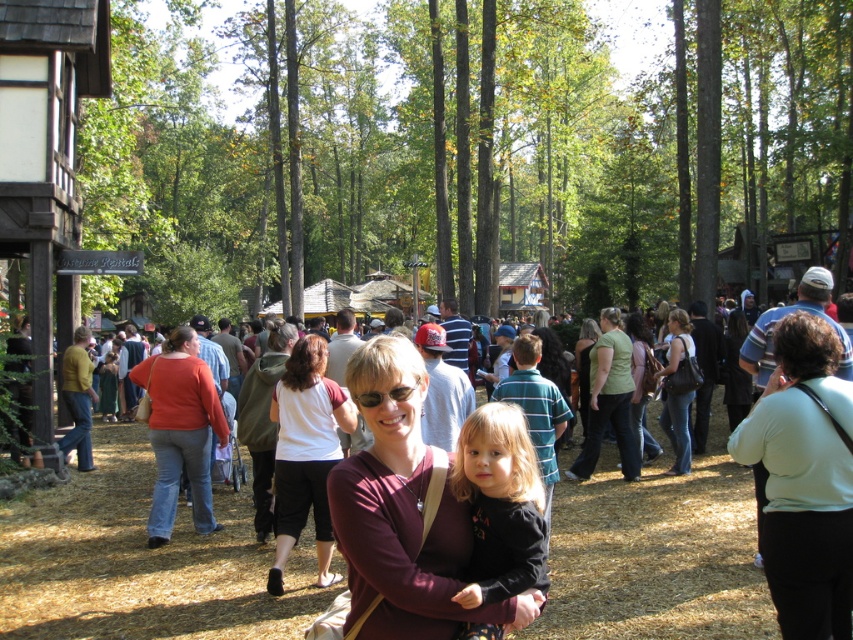
Is point (788, 458) farther from camera compared to point (184, 420)?

No, (788, 458) is in front of (184, 420).

Describe the element at coordinates (804, 480) in the screenshot. The image size is (853, 640). I see `light green fabric at center` at that location.

Does point (790, 483) lie behind point (161, 484)?

No, (790, 483) is in front of (161, 484).

Locate an element on the screen. light green fabric at center is located at coordinates (804, 480).

Which is more to the right, black matte shirt at center or matte black purse at center?

matte black purse at center

Does black matte shirt at center appear on the right side of matte black purse at center?

No, black matte shirt at center is not to the right of matte black purse at center.

At what (x,y) coordinates should I click in order to perform the action: click on black matte shirt at center. Please return your answer as a coordinate pair (x, y). Image resolution: width=853 pixels, height=640 pixels. Looking at the image, I should click on (500, 506).

Between maroon fabric shirt at center and matte black purse at center, which one is positioned lower?

matte black purse at center

Consider the image. Can you confirm if maroon fabric shirt at center is wider than matte black purse at center?

Yes.

Where is `maroon fabric shirt at center`? maroon fabric shirt at center is located at coordinates (403, 512).

Find the location of a particular element. This screenshot has width=853, height=640. maroon fabric shirt at center is located at coordinates (403, 512).